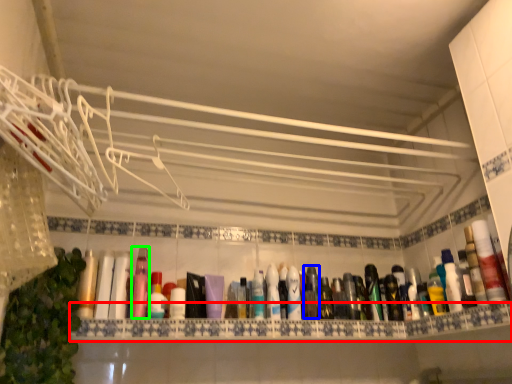
Question: Considering the real-world distances, which object is closest to ledge (highlighted by a red box)? mouthwash (highlighted by a blue box) or mouthwash (highlighted by a green box).

Choices:
 (A) mouthwash
 (B) mouthwash

Answer: (A)